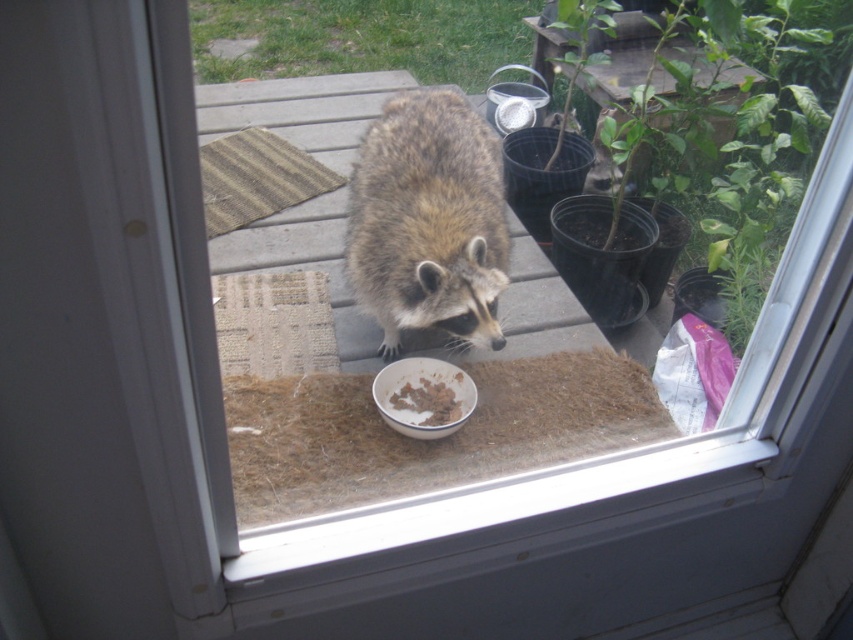
Question: Observing the image, what is the correct spatial positioning of fuzzy brown raccoon at center in reference to brown crumbly food at center?

Choices:
 (A) left
 (B) right

Answer: (A)

Question: Which point is closer to the camera taking this photo?

Choices:
 (A) (454, 385)
 (B) (350, 284)

Answer: (A)

Question: Can you confirm if fuzzy brown raccoon at center is bigger than brown crumbly food at center?

Choices:
 (A) yes
 (B) no

Answer: (A)

Question: Can you confirm if fuzzy brown raccoon at center is positioned above brown crumbly food at center?

Choices:
 (A) yes
 (B) no

Answer: (A)